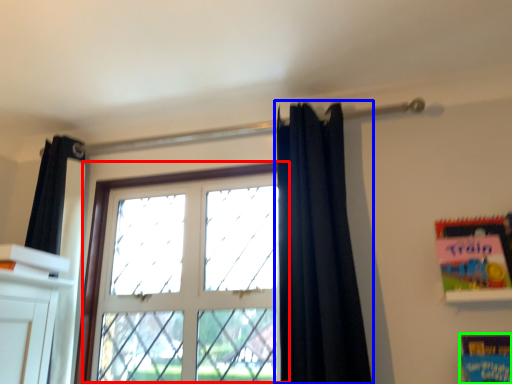
Question: Which is farther away from window (highlighted by a red box)? curtain (highlighted by a blue box) or paperback book (highlighted by a green box)?

Choices:
 (A) curtain
 (B) paperback book

Answer: (B)